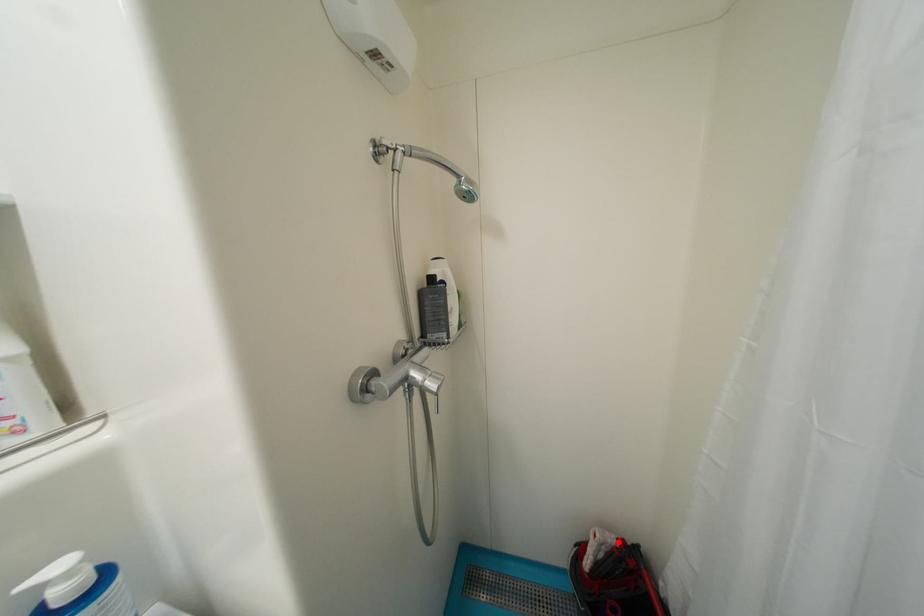
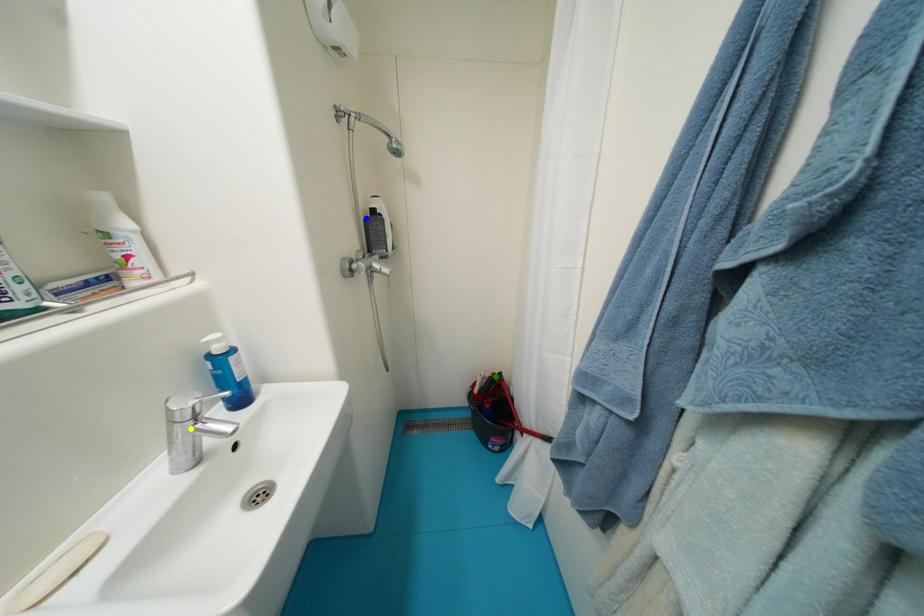
Question: I am providing you with two images of the same scene from different viewpoints. A red point is marked on the first image. You are given multiple points on the second image. In image 2, which mark is for the same physical point as the one in image 1?

Choices:
 (A) green point
 (B) yellow point
 (C) blue point

Answer: (A)